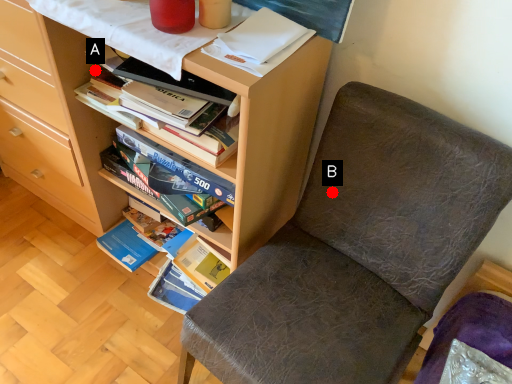
Question: Two points are circled on the image, labeled by A and B beside each circle. Which point is closer to the camera taking this photo?

Choices:
 (A) A is closer
 (B) B is closer

Answer: (B)